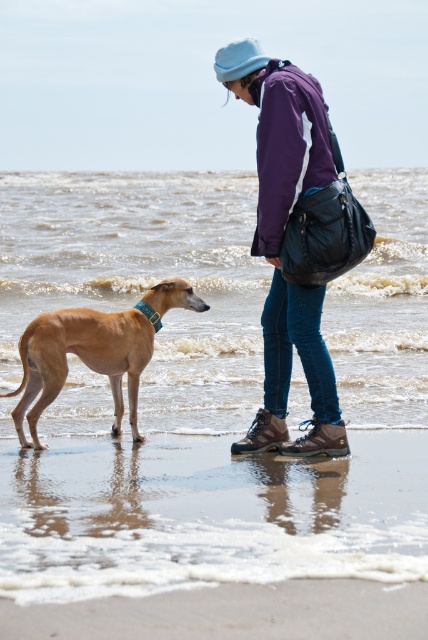
You are a photographer aiming to capture the brown smooth dog at lower left and the smooth sand at lower center in the same frame. Based on their positions, which object is closer to the camera?

The brown smooth dog at lower left is closer to the camera because the smooth sand at lower center is located below it, indicating it is positioned further back in the scene.

Looking at this image, you are a photographer trying to capture a photo of the purple matte jacket at center and the brown smooth dog at lower left. Based on their positions, which object should you adjust your camera to focus on first if you want to include both in the frame?

The brown smooth dog at lower left should be focused on first since the purple matte jacket at center is to the right of it, meaning the dog is positioned further to the left and closer to the edge of the frame. By starting with the dog, you can ensure there is enough space to include the jacket to its right.

You are a photographer trying to capture the perfect shot of the beach scene. You notice two points of interest marked at coordinates point (314, 445) and point (116, 320). Which point is closer to your camera position?

Point (314, 445) is closer to the camera than point (116, 320).